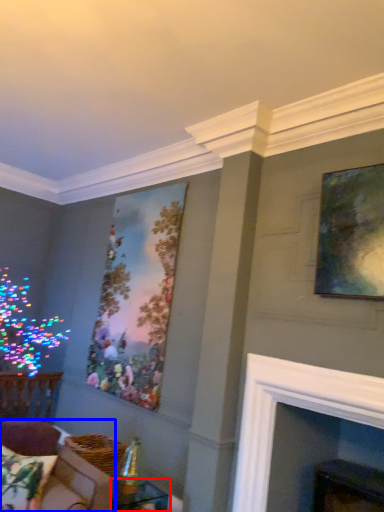
Question: Which of the following is the farthest to the observer, table (highlighted by a red box) or couch (highlighted by a blue box)?

Choices:
 (A) table
 (B) couch

Answer: (A)